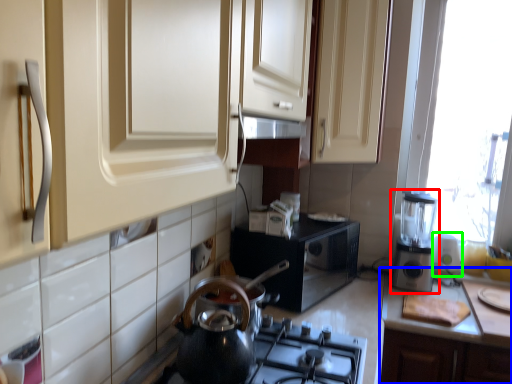
Question: Considering the real-world distances, which object is farthest from kitchen appliance (highlighted by a red box)? countertop (highlighted by a blue box) or appliance (highlighted by a green box)?

Choices:
 (A) countertop
 (B) appliance

Answer: (A)